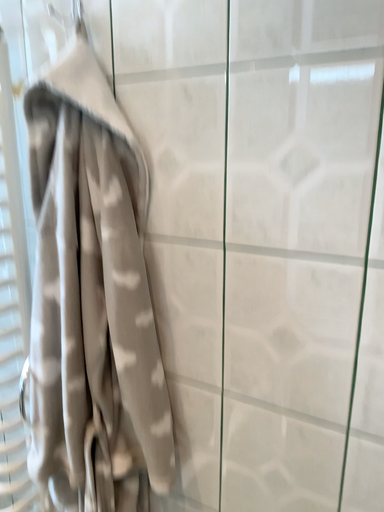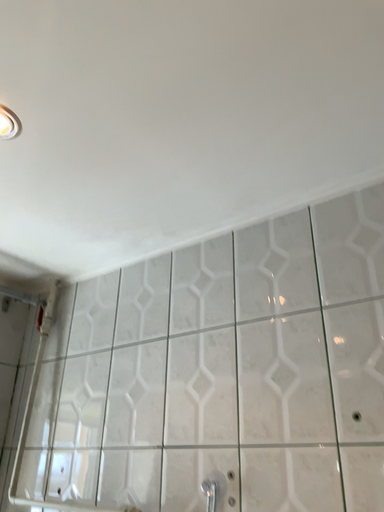
Question: Which way did the camera rotate in the video?

Choices:
 (A) rotated downward
 (B) rotated upward

Answer: (B)